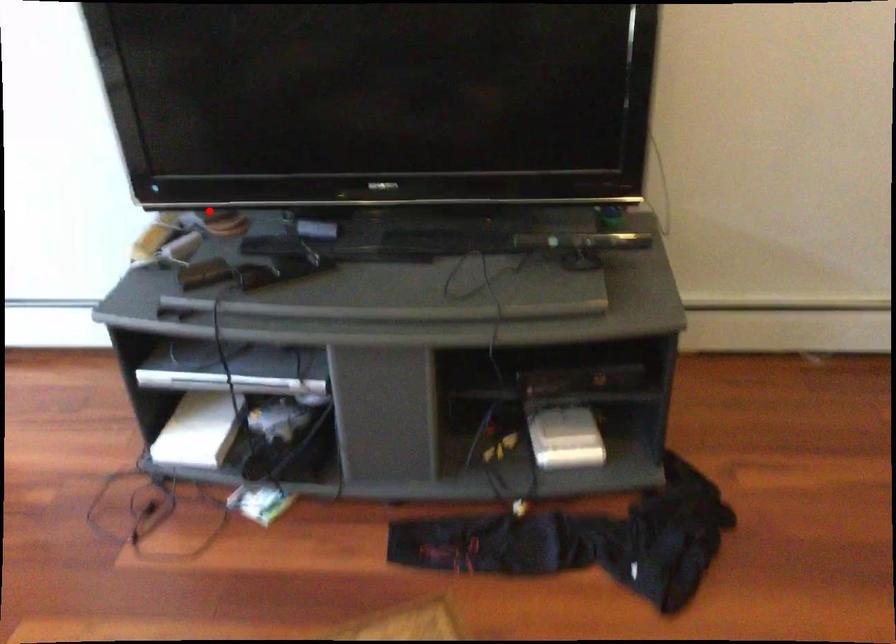
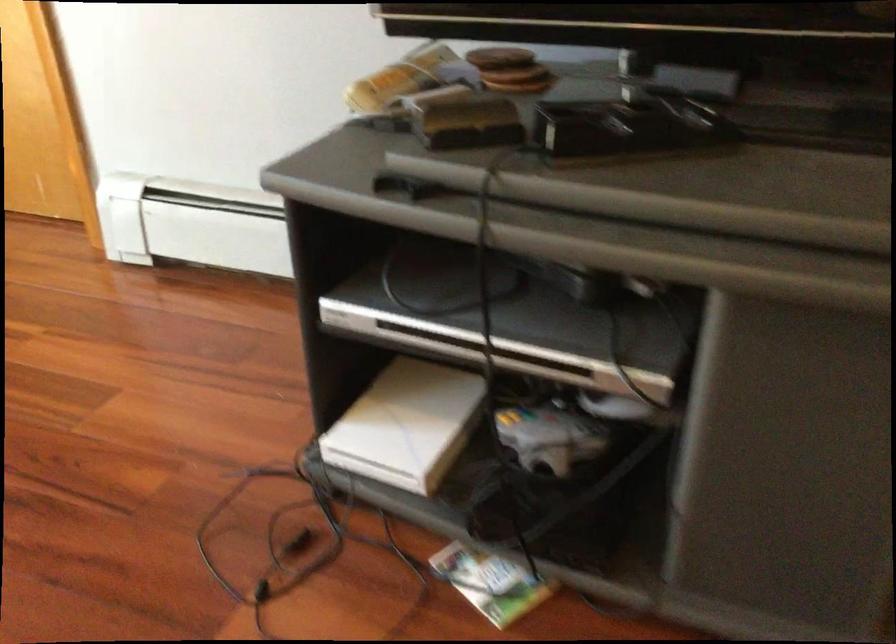
In the second image, find the point that corresponds to the highlighted location in the first image.

(500, 58)